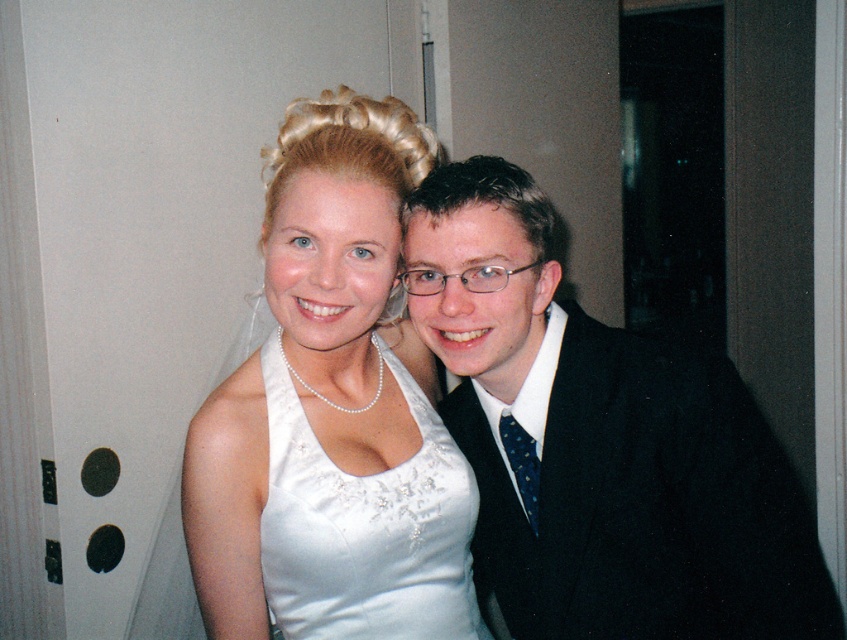
Question: Which is farther from the satin white dress at center?

Choices:
 (A) white satin dress at center
 (B) shiny black suit at right
 (C) dark blue dotted tie at center

Answer: (C)

Question: Does shiny black suit at right appear on the left side of dark blue dotted tie at center?

Choices:
 (A) no
 (B) yes

Answer: (B)

Question: Is white satin dress at center wider than dark blue dotted tie at center?

Choices:
 (A) yes
 (B) no

Answer: (A)

Question: Does shiny black suit at right come in front of white satin dress at center?

Choices:
 (A) no
 (B) yes

Answer: (A)

Question: Which is farther from the shiny black suit at right?

Choices:
 (A) satin white dress at center
 (B) white satin dress at center
 (C) dark blue dotted tie at center

Answer: (A)

Question: Which point is farther to the camera?

Choices:
 (A) (231, 600)
 (B) (422, 595)
 (C) (555, 288)
 (D) (508, 436)

Answer: (C)